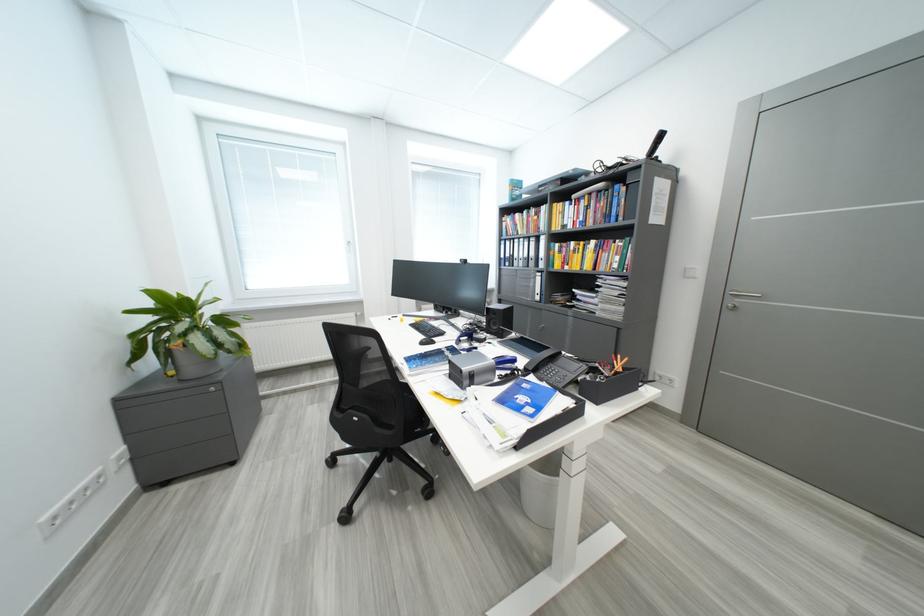
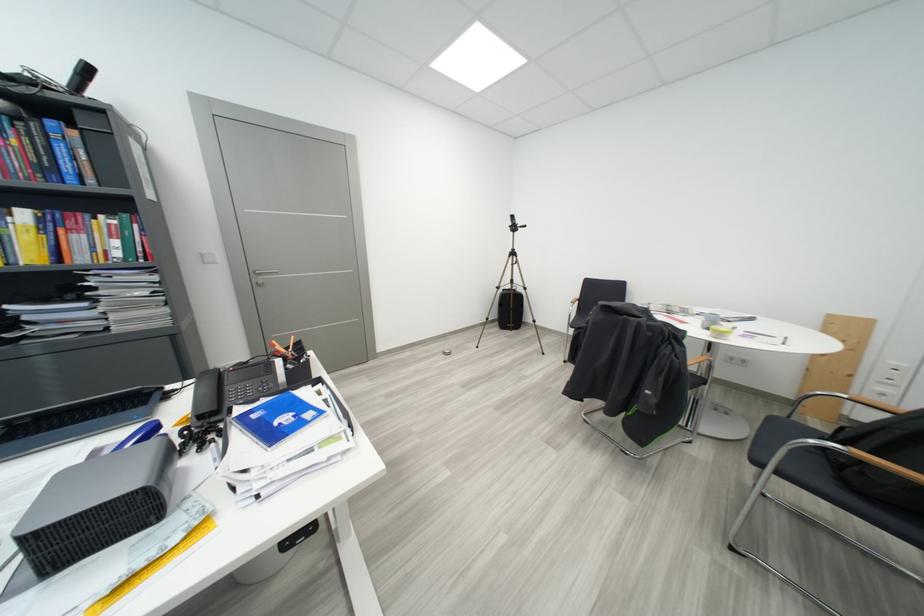
The point at (535,371) is marked in the first image. Where is the corresponding point in the second image?

(209, 419)